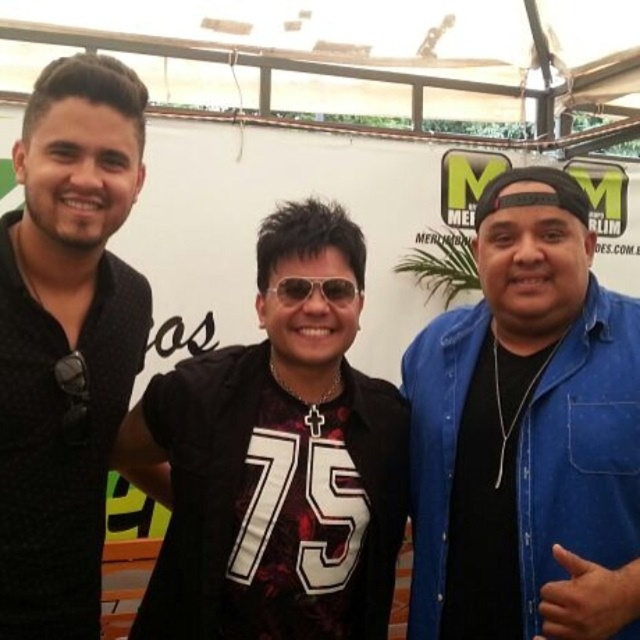
Is black matte sunglasses at center below sunglasses at center?

Yes, black matte sunglasses at center is below sunglasses at center.

Who is more distant from viewer, (372, 621) or (310, 288)?

The point (372, 621) is behind.

Locate an element on the screen. This screenshot has height=640, width=640. black matte sunglasses at center is located at coordinates (276, 464).

Is blue denim shirt at right smaller than black matte shirt at left?

Incorrect, blue denim shirt at right is not smaller in size than black matte shirt at left.

Who is more distant from viewer, (588, 413) or (26, 525)?

Positioned behind is point (588, 413).

The height and width of the screenshot is (640, 640). I want to click on blue denim shirt at right, so click(525, 433).

Between blue denim shirt at right and black matte sunglasses at center, which one appears on the right side from the viewer's perspective?

Positioned to the right is blue denim shirt at right.

This screenshot has width=640, height=640. I want to click on blue denim shirt at right, so click(525, 433).

Where is `blue denim shirt at right`? This screenshot has height=640, width=640. blue denim shirt at right is located at coordinates (525, 433).